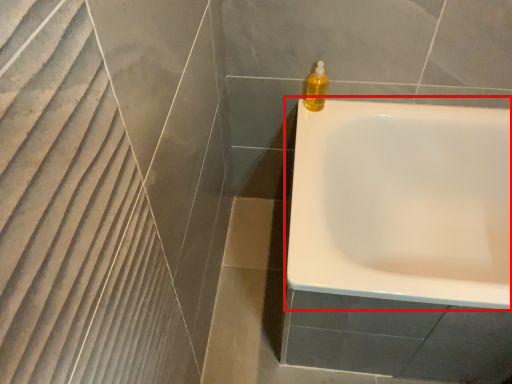
Question: From the image's perspective, considering the relative positions of bathtub (annotated by the red box) and soap dispenser in the image provided, where is bathtub (annotated by the red box) located with respect to the staircase?

Choices:
 (A) below
 (B) above

Answer: (A)